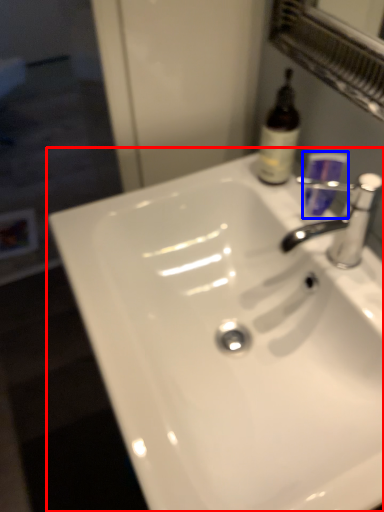
Question: Which object appears farthest to the camera in this image, sink (highlighted by a red box) or mouthwash (highlighted by a blue box)?

Choices:
 (A) sink
 (B) mouthwash

Answer: (B)